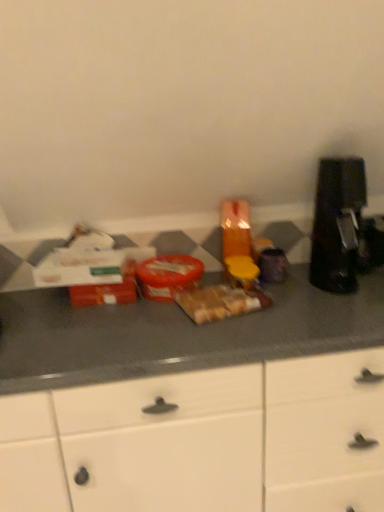
Question: From a real-world perspective, is brown matte sandwich at center, positioned as the 1th food in right-to-left order, over black plastic coffee machine at right?

Choices:
 (A) yes
 (B) no

Answer: (B)

Question: Is brown matte sandwich at center, marked as the second food in a left-to-right arrangement, oriented towards black plastic coffee machine at right?

Choices:
 (A) no
 (B) yes

Answer: (A)

Question: Are brown matte sandwich at center, positioned as the 1th food in right-to-left order, and black plastic coffee machine at right making contact?

Choices:
 (A) yes
 (B) no

Answer: (B)

Question: Is brown matte sandwich at center, marked as the second food in a left-to-right arrangement, positioned far away from black plastic coffee machine at right?

Choices:
 (A) no
 (B) yes

Answer: (A)

Question: Does brown matte sandwich at center, marked as the second food in a left-to-right arrangement, have a lesser height compared to black plastic coffee machine at right?

Choices:
 (A) no
 (B) yes

Answer: (B)

Question: Does brown matte sandwich at center, marked as the second food in a left-to-right arrangement, appear on the left side of black plastic coffee machine at right?

Choices:
 (A) no
 (B) yes

Answer: (B)

Question: From a real-world perspective, is brown matte sandwich at center, marked as the second food in a left-to-right arrangement, physically below matte plastic container at center, placed as the 1th food when sorted from left to right?

Choices:
 (A) yes
 (B) no

Answer: (A)

Question: Is brown matte sandwich at center, positioned as the 1th food in right-to-left order, smaller than matte plastic container at center, marked as the second food in a right-to-left arrangement?

Choices:
 (A) yes
 (B) no

Answer: (A)

Question: Is matte plastic container at center, marked as the second food in a right-to-left arrangement, at the back of brown matte sandwich at center, marked as the second food in a left-to-right arrangement?

Choices:
 (A) no
 (B) yes

Answer: (B)

Question: Can you confirm if brown matte sandwich at center, marked as the second food in a left-to-right arrangement, is taller than matte plastic container at center, marked as the second food in a right-to-left arrangement?

Choices:
 (A) no
 (B) yes

Answer: (A)

Question: Is brown matte sandwich at center, positioned as the 1th food in right-to-left order, shorter than matte plastic container at center, placed as the 1th food when sorted from left to right?

Choices:
 (A) yes
 (B) no

Answer: (A)

Question: Does brown matte sandwich at center, positioned as the 1th food in right-to-left order, turn towards matte plastic container at center, placed as the 1th food when sorted from left to right?

Choices:
 (A) yes
 (B) no

Answer: (B)

Question: Does matte plastic container at center, placed as the 1th food when sorted from left to right, turn towards brown matte sandwich at center, marked as the second food in a left-to-right arrangement?

Choices:
 (A) yes
 (B) no

Answer: (A)